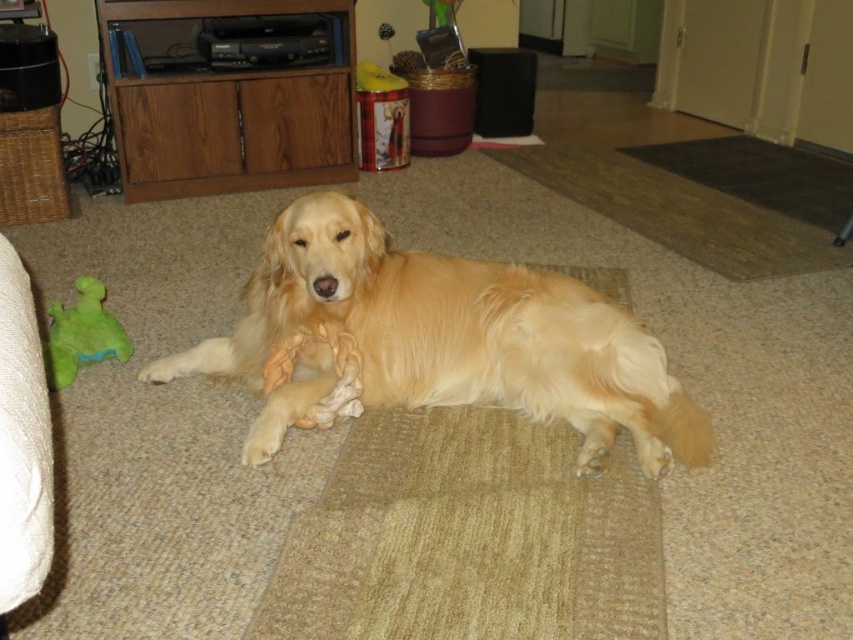
You are a photographer setting up a shot of the golden fur dog at center and the green plush toy at left. Which object is positioned closer to the camera?

The golden fur dog at center is closer to the viewer than the green plush toy at left, so the dog would appear larger in the photo.

You are a photographer setting up a tripod at point coordinates (457, 336). According to the scene, what object will be directly under the tripod?

The golden fur dog at center is located at point (457, 336), so the tripod will be placed directly over it.

You are a robotic vacuum cleaner positioned at the origin point in the room. You need to navigate to the point labeled point (601, 401). However, there is an obstacle at point (83, 276). Can you reach your destination without passing through the obstacle?

Point (601, 401) is in front of point (83, 276), so the robotic vacuum can reach point (601, 401) by navigating around the obstacle at point (83, 276) since it is behind the obstacle from the starting position.